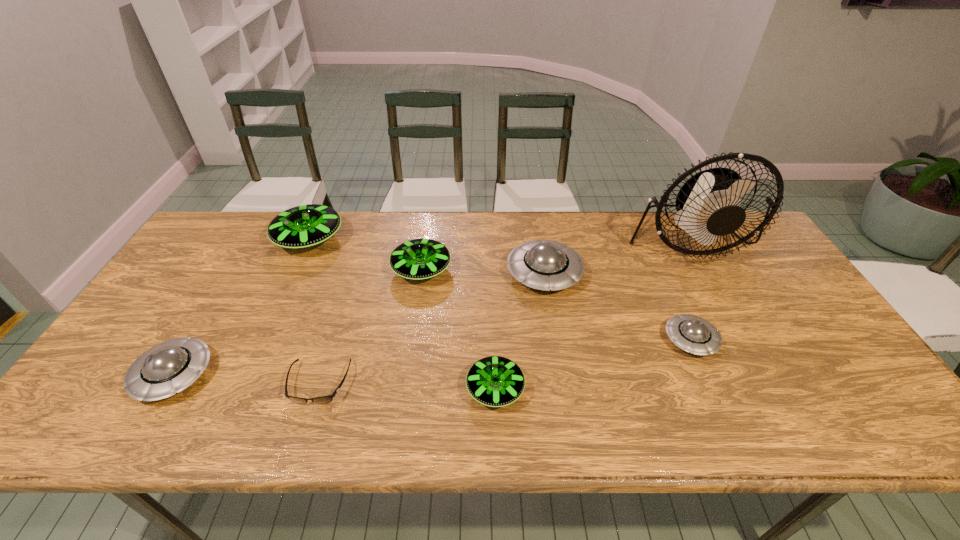
This screenshot has width=960, height=540. In order to click on the rightmost gray saucer in this screenshot , I will do `click(693, 334)`.

Where is `the rightmost saucer`? The image size is (960, 540). the rightmost saucer is located at coordinates (693, 334).

This screenshot has height=540, width=960. I want to click on the shortest object, so click(x=324, y=399).

You are a GUI agent. You are given a task and a screenshot of the screen. Output one action in this format:
    pyautogui.click(x=<x>, y=<y>)
    Task: Click on the sunglasses
    The image size is (960, 540).
    Given the screenshot: What is the action you would take?
    pyautogui.click(x=324, y=399)

Where is `vacant region located in front of the tallest object, directing airflow`? The image size is (960, 540). vacant region located in front of the tallest object, directing airflow is located at coordinates (734, 326).

Identify the location of free location located 0.330m on the front of the leftmost green saucer. The image size is (960, 540). (260, 348).

The width and height of the screenshot is (960, 540). Identify the location of free point located 0.250m on the right of the biggest gray saucer. (666, 273).

You are a GUI agent. You are given a task and a screenshot of the screen. Output one action in this format:
    pyautogui.click(x=<x>, y=<y>)
    Task: Click on the free space located 0.280m on the left of the second green saucer from right to left
    The height and width of the screenshot is (540, 960).
    Given the screenshot: What is the action you would take?
    pyautogui.click(x=299, y=270)

Where is `free region located on the right of the second smallest gray saucer`? This screenshot has width=960, height=540. free region located on the right of the second smallest gray saucer is located at coordinates tap(354, 375).

Image resolution: width=960 pixels, height=540 pixels. I want to click on vacant space situated on the back of the nearest green saucer, so [x=492, y=305].